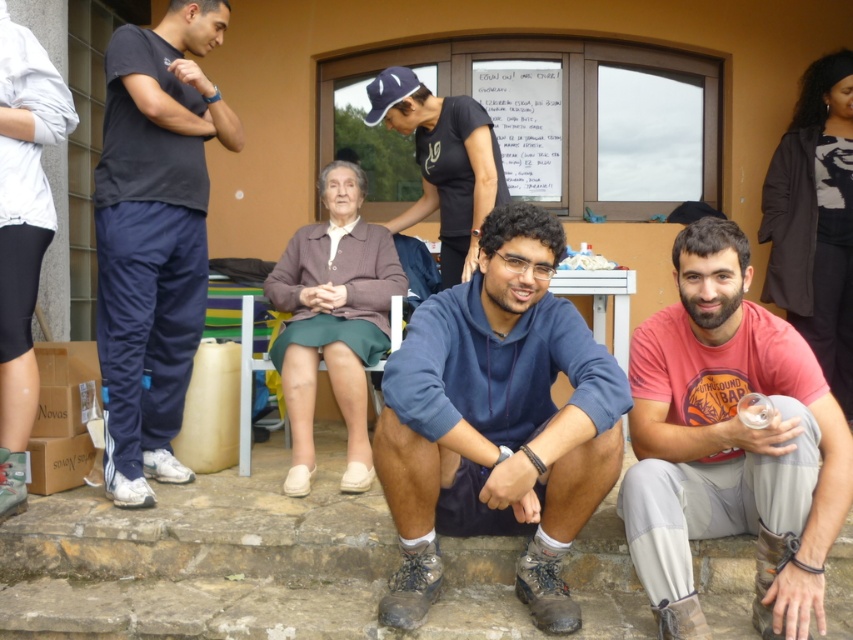
Question: Where is blue fleece at center located in relation to matte blue baseball cap at upper center in the image?

Choices:
 (A) below
 (B) above

Answer: (A)

Question: Which object is farther from the camera taking this photo?

Choices:
 (A) pink cotton t-shirt at lower right
 (B) matte blue baseball cap at upper center

Answer: (B)

Question: Can you confirm if blue fleece at center is smaller than matte blue baseball cap at upper center?

Choices:
 (A) yes
 (B) no

Answer: (B)

Question: Among these objects, which one is nearest to the camera?

Choices:
 (A) blue fleece at center
 (B) dark blue track pants at left

Answer: (A)

Question: Does blue fleece at center have a larger size compared to dark blue track pants at left?

Choices:
 (A) yes
 (B) no

Answer: (A)

Question: Which object appears farthest from the camera in this image?

Choices:
 (A) dark blue track pants at left
 (B) white paper at upper center

Answer: (B)